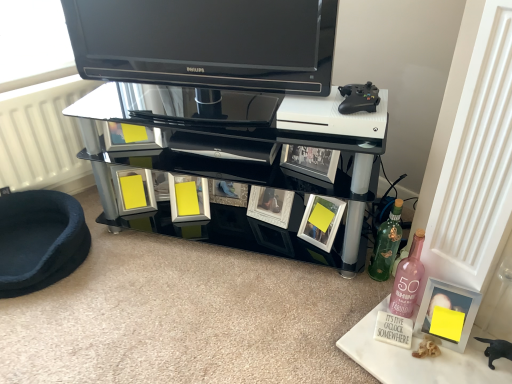
What are the coordinates of `vacant space in between pink glass bottle at lower right, the second bottle when ordered from back to front, and dark blue plush pet bed at lower left` in the screenshot? It's located at (200, 281).